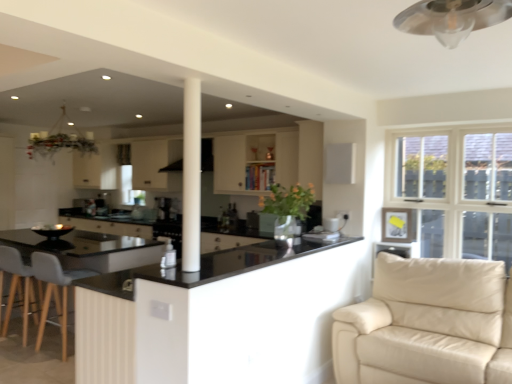
This screenshot has height=384, width=512. Find the location of `vacant area that lies in front of white smooth column at center`. vacant area that lies in front of white smooth column at center is located at coordinates pyautogui.click(x=184, y=286).